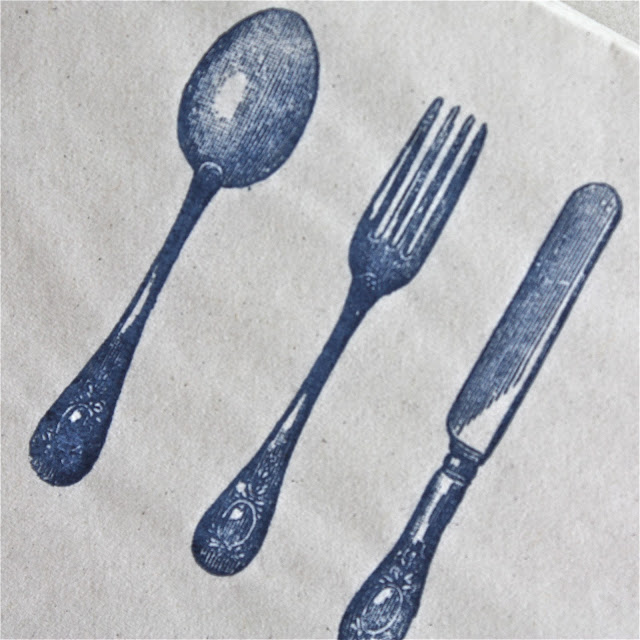
This screenshot has width=640, height=640. Find the location of `diagonal cutlery`. diagonal cutlery is located at coordinates (168, 255), (335, 352), (479, 422).